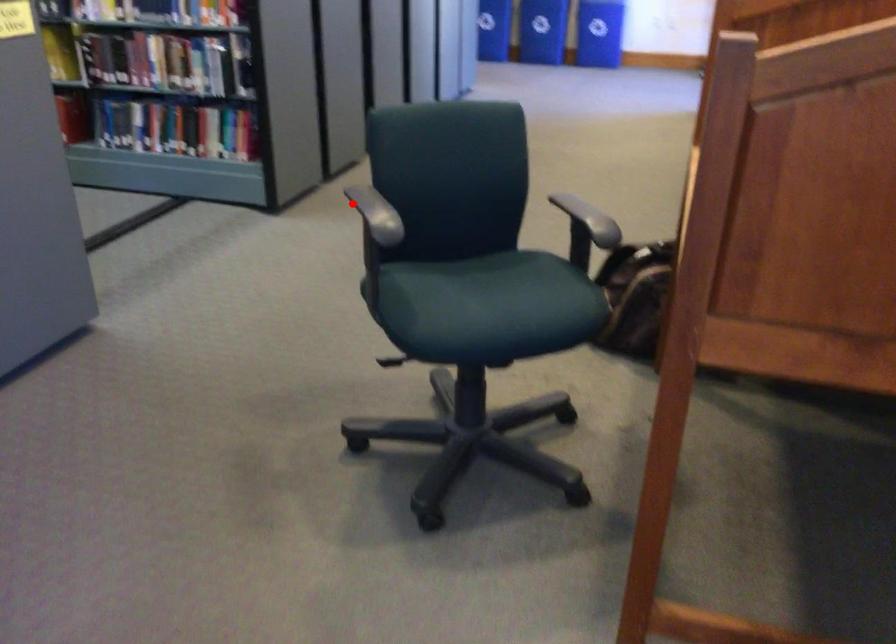
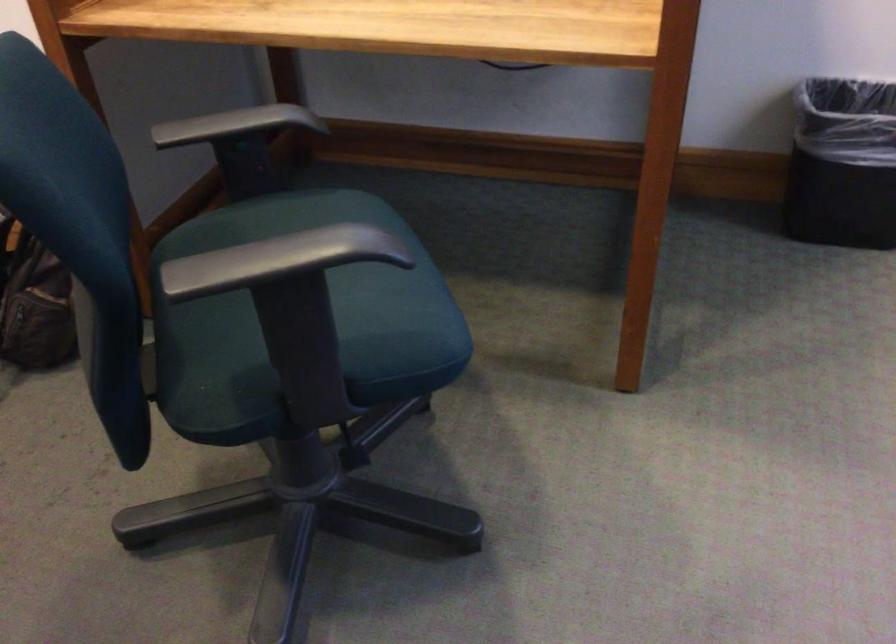
Question: I am providing you with two images of the same scene from different viewpoints. Image1 has a red point marked. In image2, the corresponding 3D location appears at what relative position? Reply with the corresponding letter.

Choices:
 (A) Closer
 (B) Farther

Answer: (A)